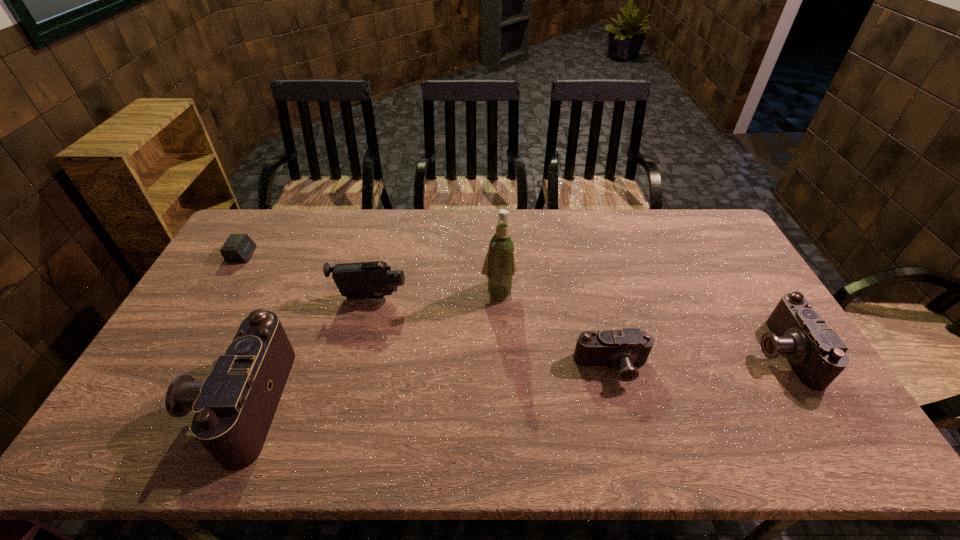
Select which object appears as the fourth closest to the third object from left to right. Please provide its 2D coordinates. Your answer should be formatted as a tuple, i.e. [(x, y)], where the tuple contains the x and y coordinates of a point satisfying the conditions above.

[(626, 348)]

Image resolution: width=960 pixels, height=540 pixels. What are the coordinates of `camera that stands as the closest to the third object from left to right` in the screenshot? It's located at (234, 407).

Select which camera appears as the closest to the shortest camera. Please provide its 2D coordinates. Your answer should be formatted as a tuple, i.e. [(x, y)], where the tuple contains the x and y coordinates of a point satisfying the conditions above.

[(816, 353)]

The height and width of the screenshot is (540, 960). Identify the location of vacant area in the image that satisfies the following two spatial constraints: 1. on the front-facing side of the second camera from left to right; 2. on the front-facing side of the leftmost camera. (621, 402).

Where is `vacant space that satisfies the following two spatial constraints: 1. on the front-facing side of the third object from right to left; 2. on the front-facing side of the leftmost camera`? vacant space that satisfies the following two spatial constraints: 1. on the front-facing side of the third object from right to left; 2. on the front-facing side of the leftmost camera is located at coordinates (504, 402).

Image resolution: width=960 pixels, height=540 pixels. In order to click on free space in the image that satisfies the following two spatial constraints: 1. on the front-facing side of the tallest object; 2. on the front-facing side of the camcorder in this screenshot , I will do `click(499, 298)`.